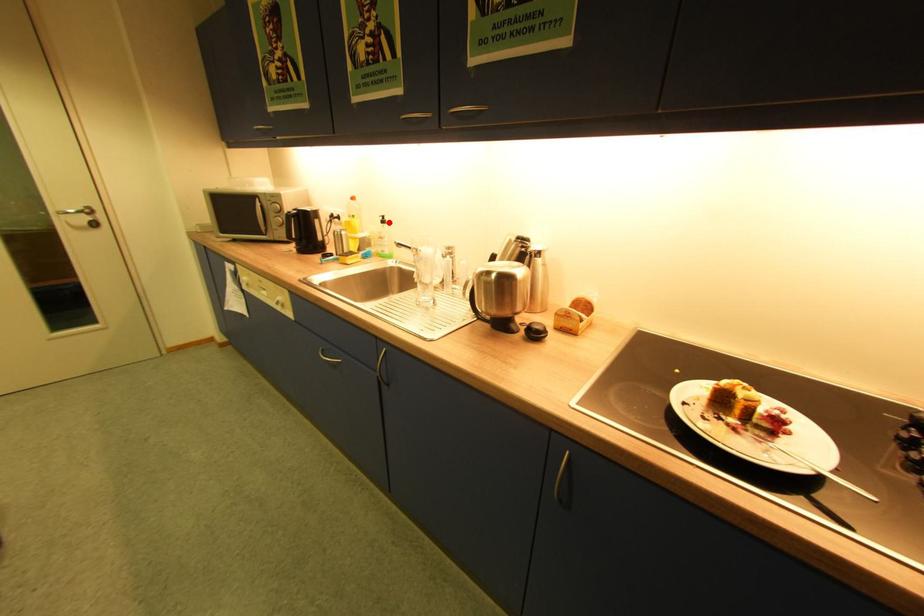
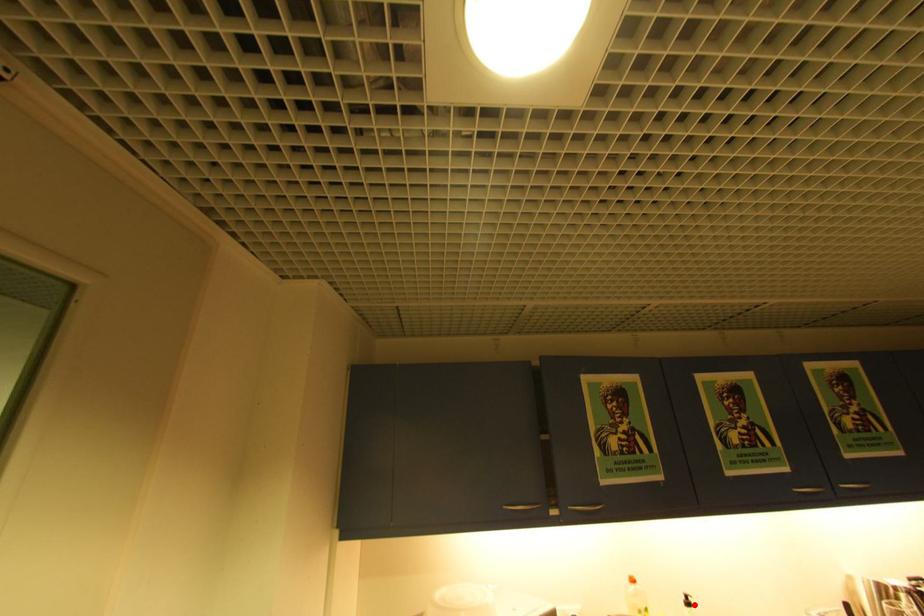
I am providing you with two images of the same scene from different viewpoints. A red point is marked on the first image and another point is marked on the second image. Is the red point in image1 aligned with the point shown in image2?

Yes